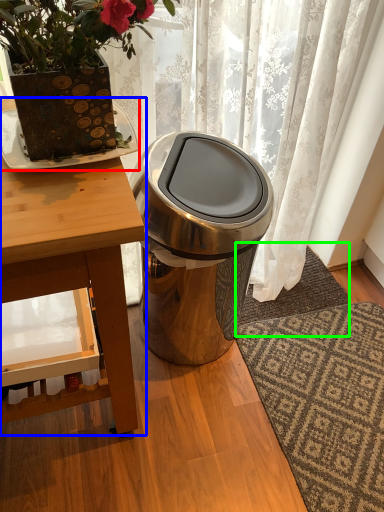
Question: Considering the real-world distances, which object is farthest from plate (highlighted by a red box)? table (highlighted by a blue box) or doormat (highlighted by a green box)?

Choices:
 (A) table
 (B) doormat

Answer: (B)